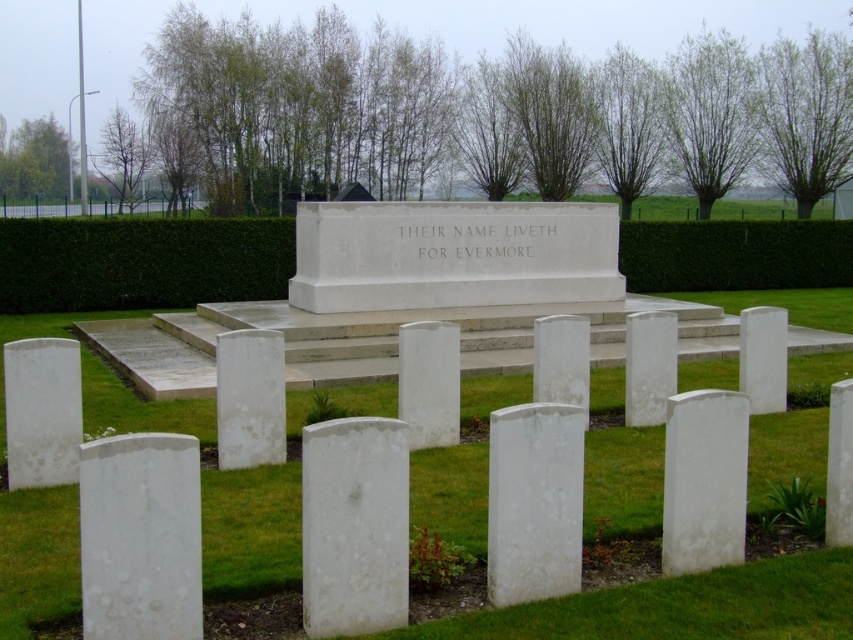
You are standing in front of the war memorial and want to walk towards the green leafy hedge at center and the green hedge at upper center. Which hedge will you reach first?

You will reach the green leafy hedge at center first because it is closer to you than the green hedge at upper center.